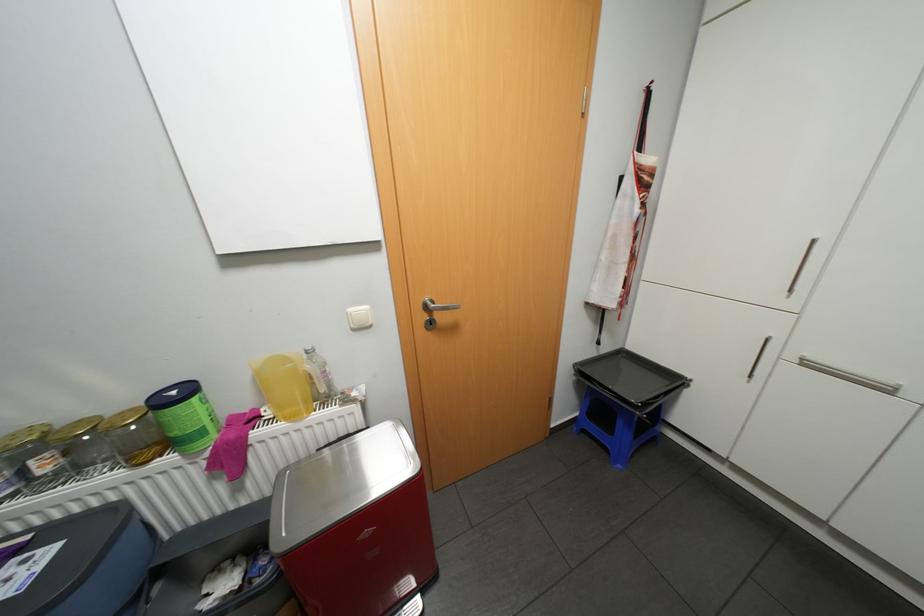
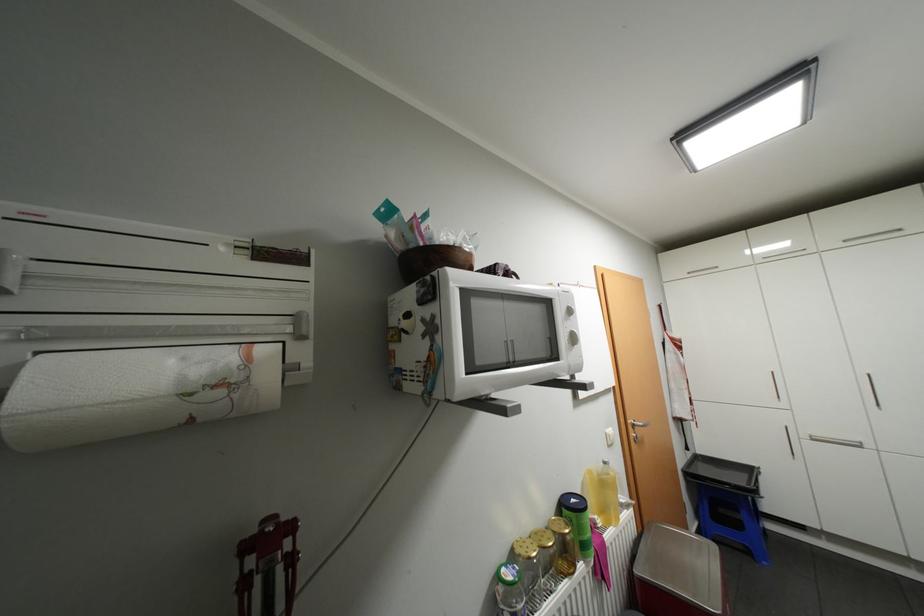
Where in the second image is the point corresponding to pixel 614 347 from the first image?

(697, 453)